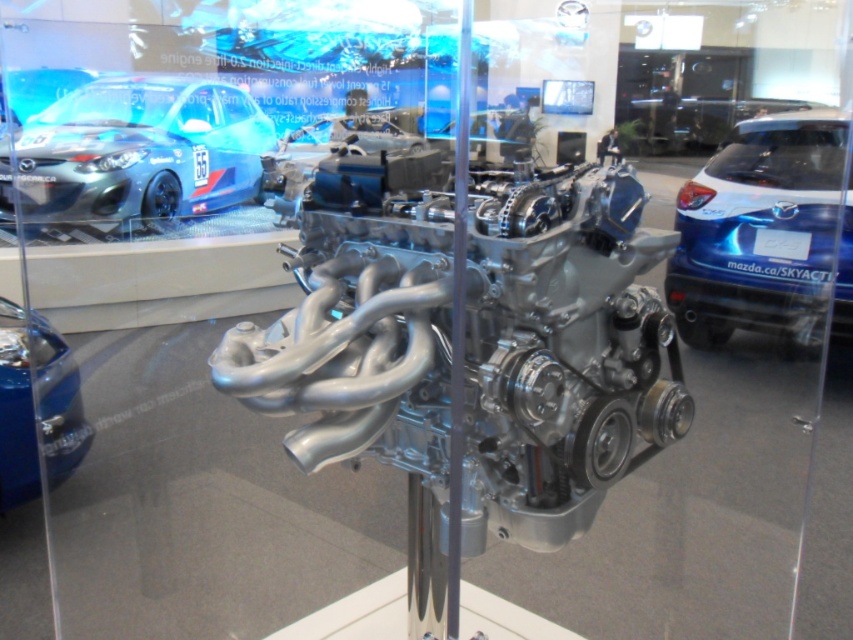
Is point (206, 81) positioned behind point (57, 365)?

Yes, point (206, 81) is behind point (57, 365).

From the picture: Who is positioned more to the left, matte blue car at upper left or shiny blue car at lower left?

matte blue car at upper left

Who is more distant from viewer, (88, 112) or (71, 364)?

The point (88, 112) is behind.

You are a GUI agent. You are given a task and a screenshot of the screen. Output one action in this format:
    pyautogui.click(x=<x>, y=<y>)
    Task: Click on the matte blue car at upper left
    
    Given the screenshot: What is the action you would take?
    pyautogui.click(x=136, y=152)

Is metallic blue hatchback at right taller than matte blue car at upper left?

No, metallic blue hatchback at right is not taller than matte blue car at upper left.

In the scene shown: Which of these two, metallic blue hatchback at right or matte blue car at upper left, stands taller?

Standing taller between the two is matte blue car at upper left.

Which is behind, point (769, 310) or point (195, 189)?

The point (195, 189) is more distant.

Locate an element on the screen. The image size is (853, 640). metallic blue hatchback at right is located at coordinates pyautogui.click(x=764, y=234).

What do you see at coordinates (764, 234) in the screenshot?
I see `metallic blue hatchback at right` at bounding box center [764, 234].

Is point (813, 168) positioned before point (18, 484)?

That is False.

You are a GUI agent. You are given a task and a screenshot of the screen. Output one action in this format:
    pyautogui.click(x=<x>, y=<y>)
    Task: Click on the metallic blue hatchback at right
    The image size is (853, 640).
    Given the screenshot: What is the action you would take?
    pyautogui.click(x=764, y=234)